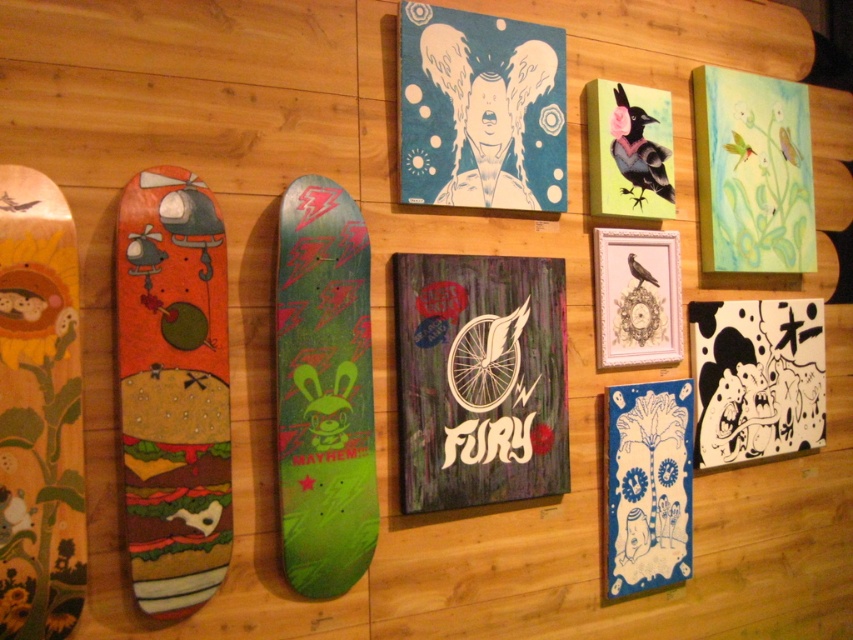
You are an art curator planning to install a new sculpture between the wooden skateboard with sunflower design at left and the matte black bird at upper right. Based on their positions, which object will the sculpture be nearer to?

The sculpture will be nearer to the wooden skateboard with sunflower design at left because it is closer to the viewer compared to the matte black bird at upper right.